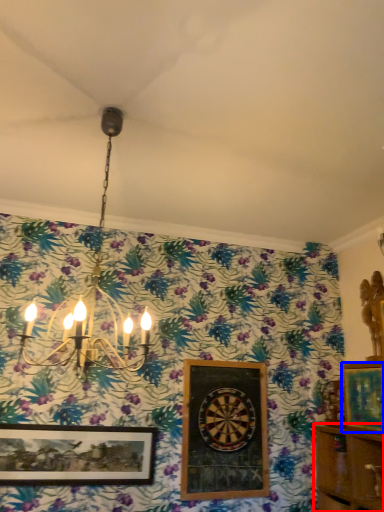
Question: Among these objects, which one is nearest to the camera, shelf (highlighted by a red box) or picture frame (highlighted by a blue box)?

Choices:
 (A) shelf
 (B) picture frame

Answer: (A)